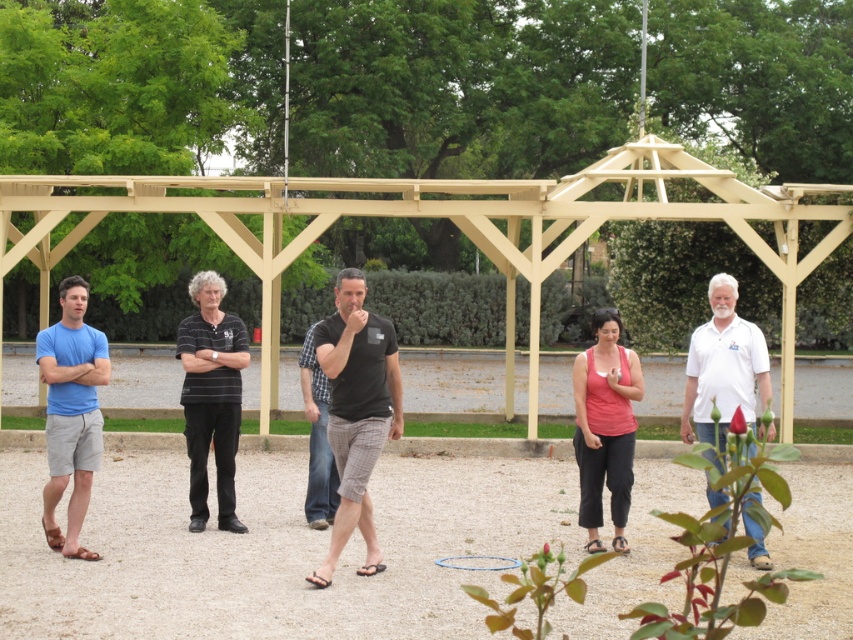
Which of these two, pink fabric tank top at center or black cotton shirt at center, stands shorter?

With less height is black cotton shirt at center.

Is pink fabric tank top at center below black cotton shirt at center?

No.

Between point (625, 413) and point (311, 520), which one is positioned behind?

The point (311, 520) is more distant.

The image size is (853, 640). Find the location of `pink fabric tank top at center`. pink fabric tank top at center is located at coordinates (605, 426).

Is the position of pink fabric tank top at center more distant than that of white cotton shirt at right?

Yes, it is behind white cotton shirt at right.

Does point (630, 358) lie in front of point (709, 348)?

No.

Locate an element on the screen. pink fabric tank top at center is located at coordinates (605, 426).

This screenshot has width=853, height=640. What are the coordinates of `pink fabric tank top at center` in the screenshot? It's located at (605, 426).

Measure the distance between black checkered shorts at center and camera.

black checkered shorts at center is 35.81 feet from camera.

Who is positioned more to the right, black checkered shorts at center or blue cotton t-shirt at left?

From the viewer's perspective, black checkered shorts at center appears more on the right side.

Which is behind, point (347, 460) or point (71, 516)?

The point (71, 516) is more distant.

Where is `black checkered shorts at center`? black checkered shorts at center is located at coordinates (357, 412).